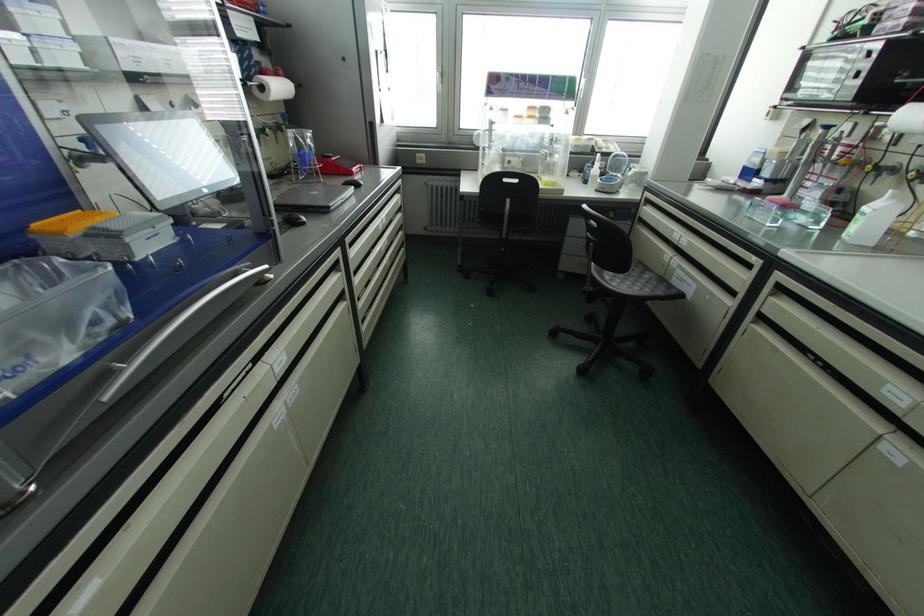
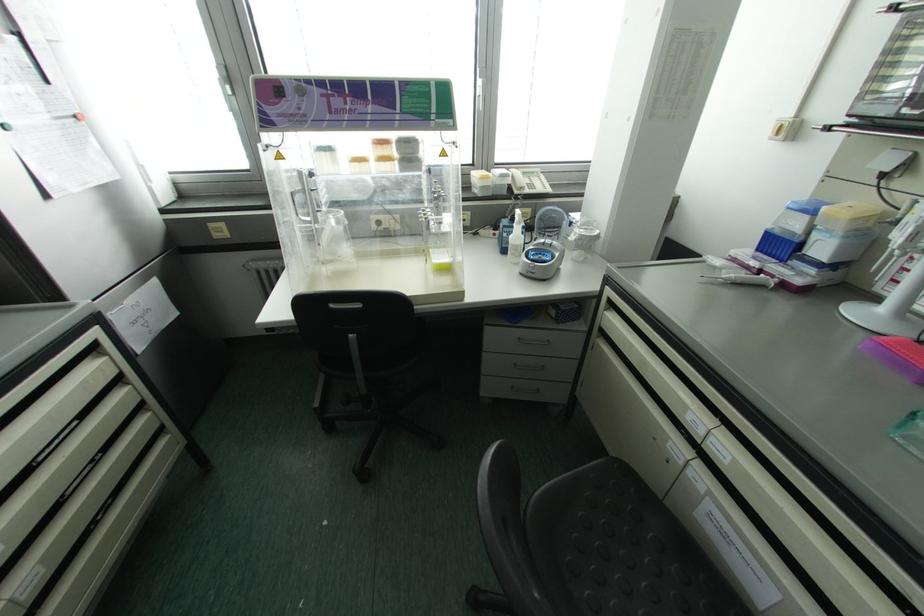
In the second image, find the point that corresponds to the point at 516,75 in the first image.

(320, 82)